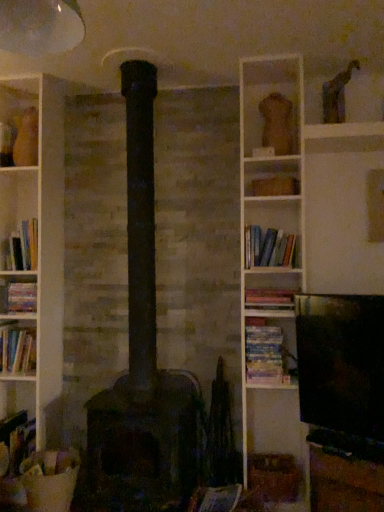
Question: Considering the relative positions of dark gray stone stove at center and wooden at center, the first shelf from the right, in the image provided, is dark gray stone stove at center to the left or to the right of wooden at center, the first shelf from the right,?

Choices:
 (A) right
 (B) left

Answer: (B)

Question: Is dark gray stone stove at center situated inside wooden at center, marked as the second shelf in a back-to-front arrangement, or outside?

Choices:
 (A) outside
 (B) inside

Answer: (A)

Question: Based on their relative distances, which object is nearer to the dark gray stone stove at center?

Choices:
 (A) matte pink book at center, positioned as the 4th book in top-to-bottom order
 (B) wooden at center, the first shelf in the front-to-back sequence
 (C) hardcover book at lower left, the 1th book viewed from the left
 (D) hardcover books at center-right, which appears as the 2th book when viewed from the top
 (E) hardcover book at left, which appears as the 3th book when viewed from the top

Answer: (C)

Question: Considering the real-world distances, which object is farthest from the dark gray stone stove at center?

Choices:
 (A) wooden box at upper center, which ranks as the 1th shelf in back-to-front order
 (B) hardcover books at left, positioned as the first book in top-to-bottom order
 (C) hardcover book at lower left, which ranks as the first book in bottom-to-top order
 (D) hardcover books at center-right, which appears as the 2th book when viewed from the top
 (E) wooden at center, which is counted as the 2th shelf, starting from the top

Answer: (A)